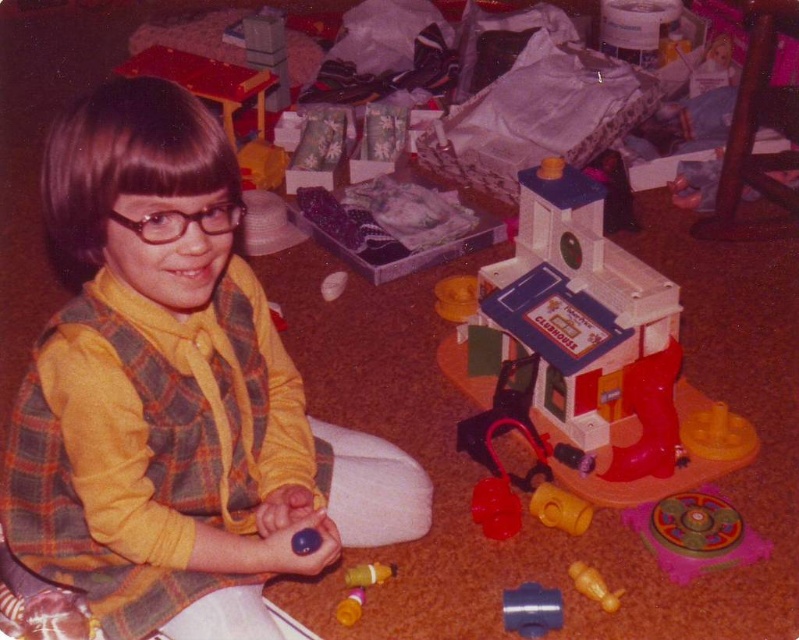
Is point (144, 602) in front of point (360, 584)?

Yes, it is in front of point (360, 584).

Locate an element on the screen. This screenshot has width=799, height=640. yellow plaid vest at center is located at coordinates (156, 378).

Consider the image. Between pink plastic toy at lower right and translucent plastic toy at center, which one is positioned higher?

pink plastic toy at lower right is higher up.

Does pink plastic toy at lower right appear on the left side of translucent plastic toy at center?

No, pink plastic toy at lower right is not to the left of translucent plastic toy at center.

Between point (666, 499) and point (364, 600), which one is positioned in front?

Point (364, 600)

Where is `pink plastic toy at lower right`? Image resolution: width=799 pixels, height=640 pixels. pink plastic toy at lower right is located at coordinates (694, 532).

Consider the image. Can you confirm if translucent plastic toy at center is bigger than glossy plastic ball at lower center?

Yes.

Is translucent plastic toy at center in front of glossy plastic ball at lower center?

No, translucent plastic toy at center is further to the viewer.

Is point (372, 577) less distant than point (320, 538)?

No.

You are a GUI agent. You are given a task and a screenshot of the screen. Output one action in this format:
    pyautogui.click(x=<x>, y=<y>)
    Task: Click on the translucent plastic toy at center
    
    Given the screenshot: What is the action you would take?
    pyautogui.click(x=360, y=588)